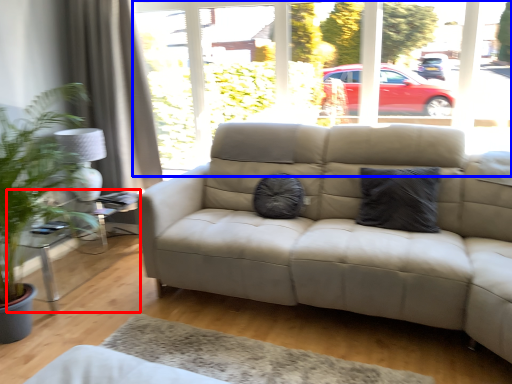
Question: Which object is closer to the camera taking this photo, table (highlighted by a red box) or window frame (highlighted by a blue box)?

Choices:
 (A) table
 (B) window frame

Answer: (B)